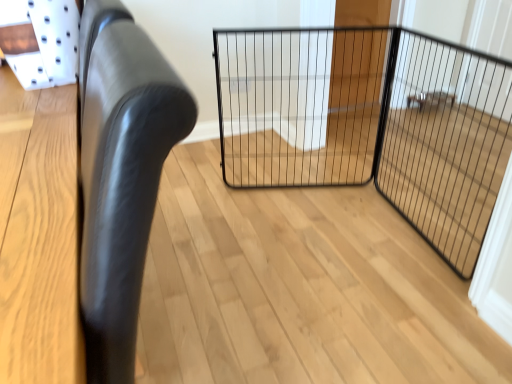
Question: Is black wire mesh screen door at center in front of black wire mesh gate at center?

Choices:
 (A) yes
 (B) no

Answer: (A)

Question: Is black wire mesh screen door at center outside black wire mesh gate at center?

Choices:
 (A) no
 (B) yes

Answer: (B)

Question: Is black wire mesh screen door at center further to camera compared to black wire mesh gate at center?

Choices:
 (A) no
 (B) yes

Answer: (A)

Question: From a real-world perspective, is black wire mesh screen door at center located higher than black wire mesh gate at center?

Choices:
 (A) yes
 (B) no

Answer: (A)

Question: Is black wire mesh screen door at center bigger than black wire mesh gate at center?

Choices:
 (A) yes
 (B) no

Answer: (B)

Question: Is black wire mesh screen door at center surrounding black wire mesh gate at center?

Choices:
 (A) yes
 (B) no

Answer: (B)

Question: Can you confirm if black wire mesh screen door at center is shorter than black leather chair at left?

Choices:
 (A) no
 (B) yes

Answer: (B)

Question: From a real-world perspective, is black wire mesh screen door at center located beneath black leather chair at left?

Choices:
 (A) yes
 (B) no

Answer: (A)

Question: Is the depth of black wire mesh screen door at center less than that of black leather chair at left?

Choices:
 (A) no
 (B) yes

Answer: (A)

Question: Does black wire mesh screen door at center come behind black leather chair at left?

Choices:
 (A) no
 (B) yes

Answer: (B)

Question: From a real-world perspective, is black wire mesh screen door at center on top of black leather chair at left?

Choices:
 (A) yes
 (B) no

Answer: (B)

Question: Does black wire mesh screen door at center appear on the right side of black leather chair at left?

Choices:
 (A) yes
 (B) no

Answer: (A)

Question: From a real-world perspective, is black leather chair at left under black wire mesh gate at center?

Choices:
 (A) no
 (B) yes

Answer: (A)